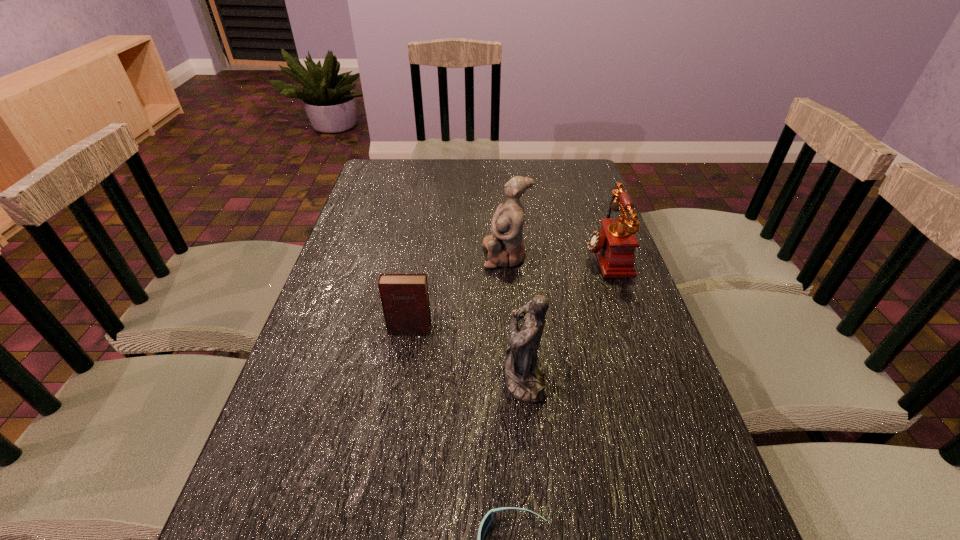
Identify the location of vacant space located 0.190m on the front-facing side of the fourth farthest object. This screenshot has height=540, width=960. (415, 377).

Where is `vacant space located 0.180m on the front-facing side of the fourth farthest object`? Image resolution: width=960 pixels, height=540 pixels. vacant space located 0.180m on the front-facing side of the fourth farthest object is located at coordinates (420, 377).

At what (x,y) coordinates should I click in order to perform the action: click on free point located 0.300m on the dial of the telephone. Please return your answer as a coordinate pair (x, y). Looking at the image, I should click on (479, 255).

This screenshot has width=960, height=540. In order to click on free space located 0.320m on the dial of the telephone in this screenshot , I will do `click(471, 255)`.

Identify the location of vacant space located 0.050m on the dial of the telephone. (566, 255).

This screenshot has height=540, width=960. What are the coordinates of `vacant space situated on the front cover of the third farthest object` in the screenshot? It's located at (379, 516).

This screenshot has width=960, height=540. Find the location of `object situated at the right edge`. object situated at the right edge is located at coordinates (614, 244).

The image size is (960, 540). In the image, there is a desktop. What are the coordinates of `vacant space at the far edge` in the screenshot? It's located at (473, 183).

Locate an element on the screen. free space at the left edge of the desktop is located at coordinates (298, 415).

I want to click on vacant space at the right edge of the desktop, so click(575, 244).